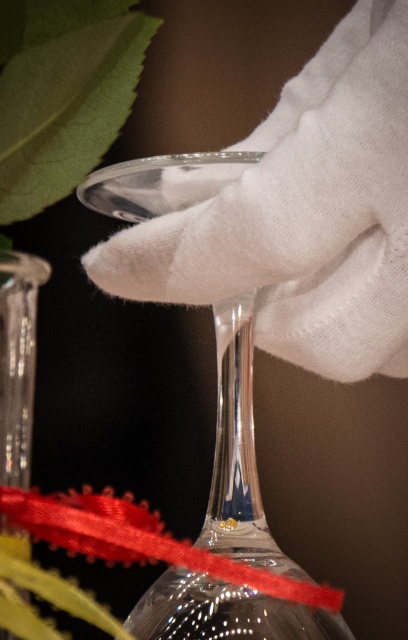
Is white cotton glove at center smaller than red satin ribbon at lower center?

No.

What do you see at coordinates (301, 212) in the screenshot? Image resolution: width=408 pixels, height=640 pixels. I see `white cotton glove at center` at bounding box center [301, 212].

You are a GUI agent. You are given a task and a screenshot of the screen. Output one action in this format:
    pyautogui.click(x=<x>, y=<y>)
    Task: Click on the white cotton glove at center
    The height and width of the screenshot is (640, 408).
    Given the screenshot: What is the action you would take?
    pyautogui.click(x=301, y=212)

Does white cotton glove at center appear under transparent glass wine glass at center?

Incorrect, white cotton glove at center is not positioned below transparent glass wine glass at center.

What do you see at coordinates (301, 212) in the screenshot?
I see `white cotton glove at center` at bounding box center [301, 212].

Image resolution: width=408 pixels, height=640 pixels. In order to click on white cotton glove at center in this screenshot , I will do `click(301, 212)`.

Does point (144, 596) come behind point (33, 321)?

Yes.

Which is behind, point (197, 620) or point (19, 269)?

The point (197, 620) is more distant.

Who is more distant from viewer, (235,435) or (22,349)?

Positioned behind is point (235,435).

Where is `transparent glass wine glass at center`? The width and height of the screenshot is (408, 640). transparent glass wine glass at center is located at coordinates (237, 451).